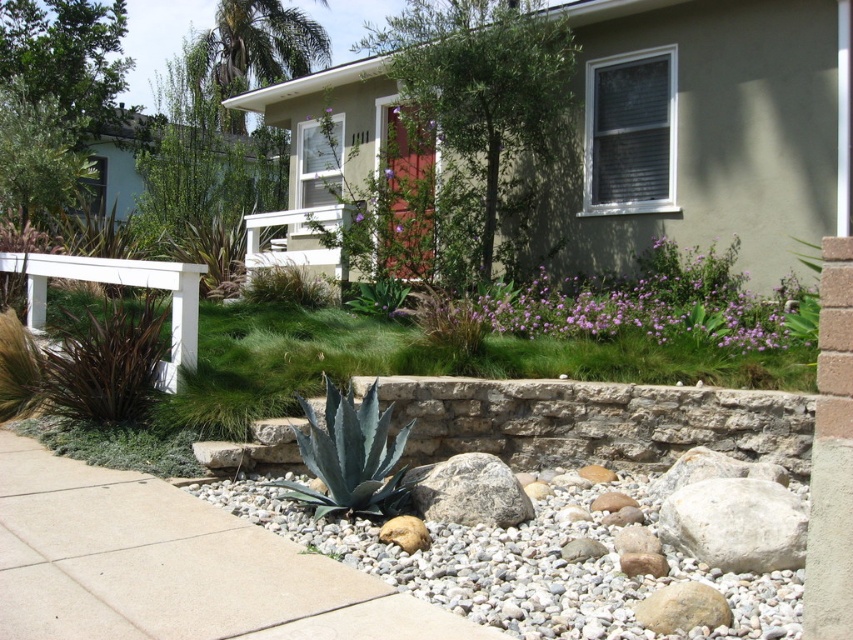
You are a gardener who wants to plant a new flower in the front yard. You have two options from your inventory. One is a single purple matte flower at center, and the other is a group of purple matte flowers at center. Which option would take up more space in the rock bed?

The purple matte flowers at center might be wider than purple matte flower at center, so the group of purple matte flowers at center would take up more space in the rock bed.

You are standing on the sidewalk in front of the house and see the gray gravel at lower center marked by point (531, 564). Is this point located within the garden area or the paved sidewalk?

The gray gravel at lower center is represented by point (531, 564). Since the gray gravel is part of the garden area with small white pebbles and larger rocks, the point is within the garden area.

Consider the image. You are standing on the sidewalk looking at the front yard. There are two points marked in the image, point 1 at coordinates point (807, 336) and point 2 at point (361, 218). Which point is closer to you?

Point (807, 336) is closer to the camera than point (361, 218), so the point closer to you is point (807, 336).